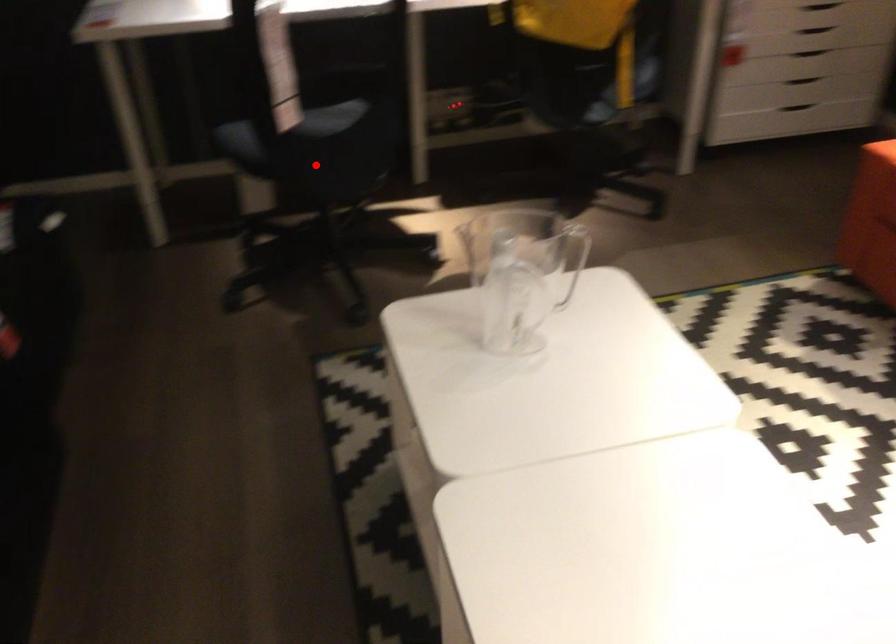
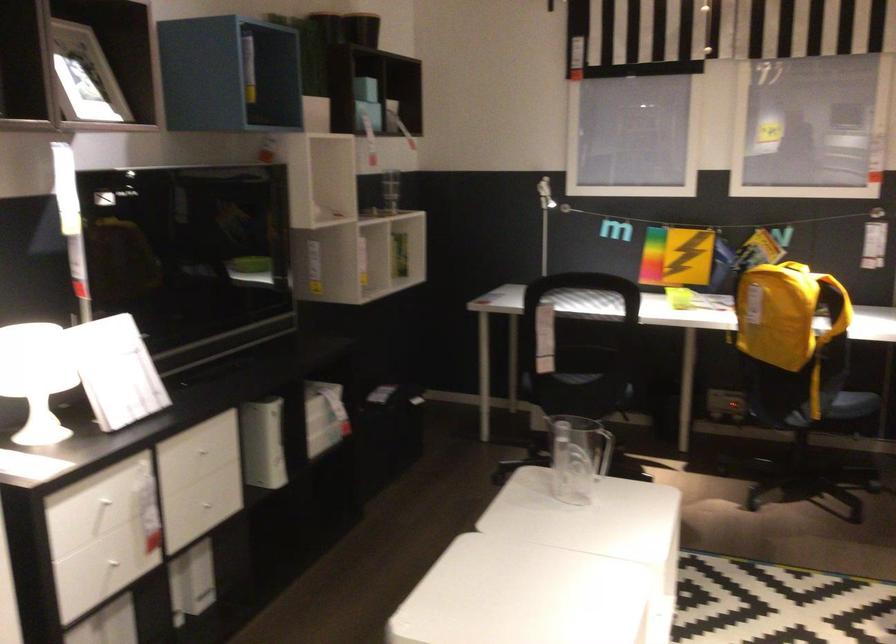
Question: A red point is marked in image1. In image2, is the corresponding 3D point closer to the camera or farther? Reply with the corresponding letter.

Choices:
 (A) The corresponding 3D point is closer.
 (B) The corresponding 3D point is farther.

Answer: (B)